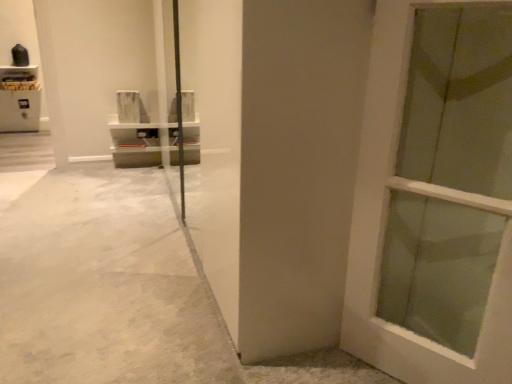
Question: Is wooden shelf at upper left positioned in front of white matte door at center?

Choices:
 (A) no
 (B) yes

Answer: (A)

Question: Are wooden shelf at upper left and white matte door at center located far from each other?

Choices:
 (A) no
 (B) yes

Answer: (B)

Question: From a real-world perspective, is wooden shelf at upper left physically below white matte door at center?

Choices:
 (A) yes
 (B) no

Answer: (A)

Question: Does wooden shelf at upper left have a lesser width compared to white matte door at center?

Choices:
 (A) no
 (B) yes

Answer: (A)

Question: From a real-world perspective, is wooden shelf at upper left located higher than white matte door at center?

Choices:
 (A) no
 (B) yes

Answer: (A)

Question: From a real-world perspective, is wooden shelf at upper left positioned above or below white matte door at center?

Choices:
 (A) below
 (B) above

Answer: (A)

Question: In the image, is wooden shelf at upper left positioned in front of or behind white matte door at center?

Choices:
 (A) front
 (B) behind

Answer: (B)

Question: From the image's perspective, is wooden shelf at upper left positioned above or below white matte door at center?

Choices:
 (A) below
 (B) above

Answer: (B)

Question: In terms of height, does wooden shelf at upper left look taller or shorter compared to white matte door at center?

Choices:
 (A) tall
 (B) short

Answer: (B)

Question: Is white polished concrete at center to the left or to the right of white matte door at center in the image?

Choices:
 (A) left
 (B) right

Answer: (A)

Question: Relative to white matte door at center, is white polished concrete at center in front or behind?

Choices:
 (A) behind
 (B) front

Answer: (A)

Question: From a real-world perspective, is white polished concrete at center physically located above or below white matte door at center?

Choices:
 (A) above
 (B) below

Answer: (B)

Question: Is white polished concrete at center spatially inside white matte door at center, or outside of it?

Choices:
 (A) inside
 (B) outside

Answer: (B)

Question: Based on their positions, is wooden shelf at upper left located to the left or right of white polished concrete at center?

Choices:
 (A) right
 (B) left

Answer: (B)

Question: From a real-world perspective, relative to white polished concrete at center, is wooden shelf at upper left vertically above or below?

Choices:
 (A) below
 (B) above

Answer: (B)